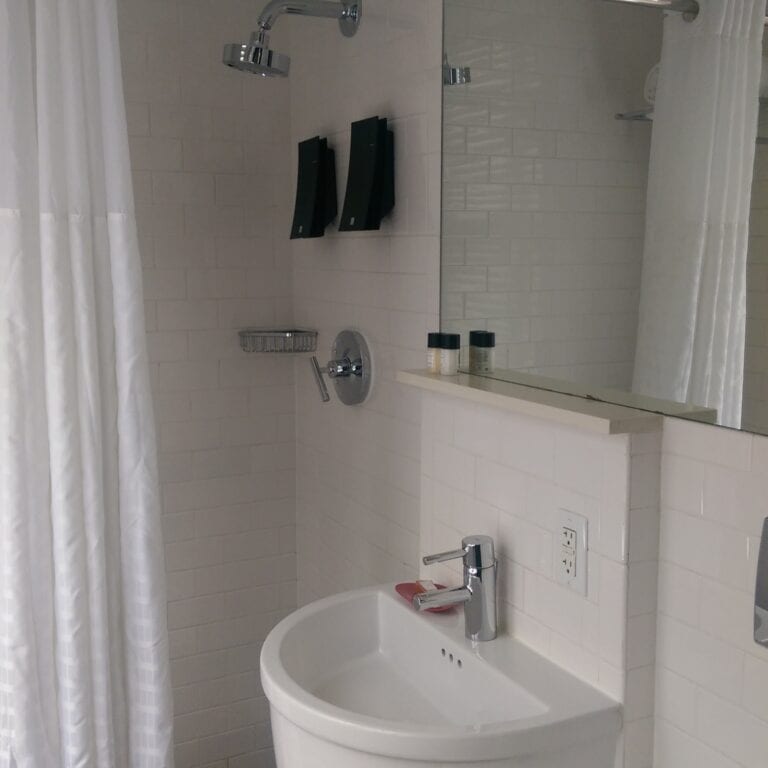
This screenshot has height=768, width=768. I want to click on white tile, so click(x=386, y=501).